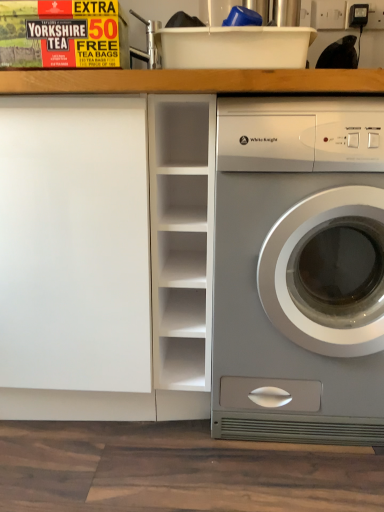
Question: Is satin silver washer at right situated inside white matte bookshelf at center or outside?

Choices:
 (A) inside
 (B) outside

Answer: (B)

Question: Does point (221, 394) appear closer or farther from the camera than point (163, 334)?

Choices:
 (A) farther
 (B) closer

Answer: (B)

Question: Considering the positions of satin silver washer at right and white matte bookshelf at center in the image, is satin silver washer at right wider or thinner than white matte bookshelf at center?

Choices:
 (A) wide
 (B) thin

Answer: (B)

Question: From the image's perspective, is white matte bookshelf at center located above or below satin silver washer at right?

Choices:
 (A) above
 (B) below

Answer: (A)

Question: Does point (165, 178) appear closer or farther from the camera than point (375, 225)?

Choices:
 (A) closer
 (B) farther

Answer: (B)

Question: Considering the positions of white matte bookshelf at center and satin silver washer at right in the image, is white matte bookshelf at center taller or shorter than satin silver washer at right?

Choices:
 (A) short
 (B) tall

Answer: (A)

Question: In the image, is white matte bookshelf at center positioned in front of or behind satin silver washer at right?

Choices:
 (A) behind
 (B) front

Answer: (A)